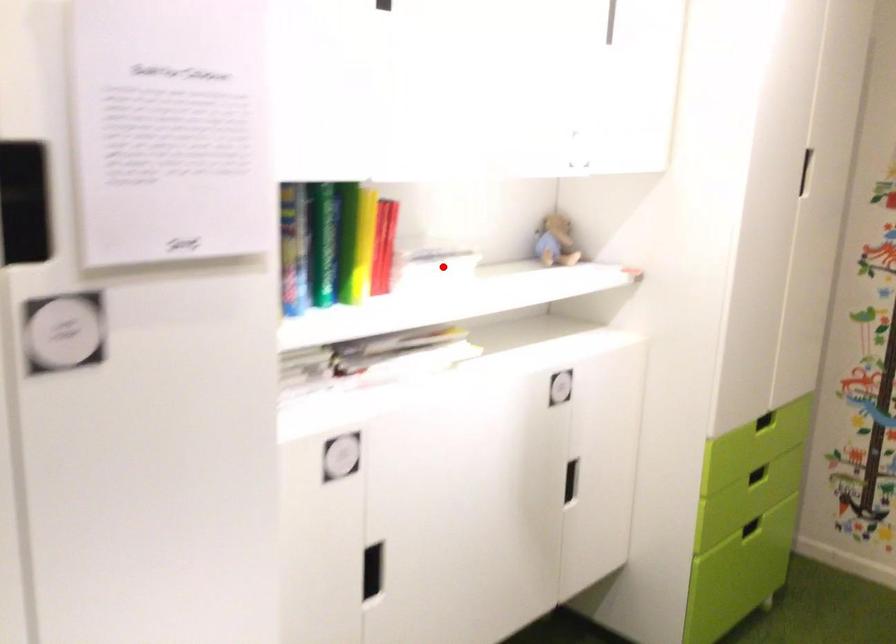
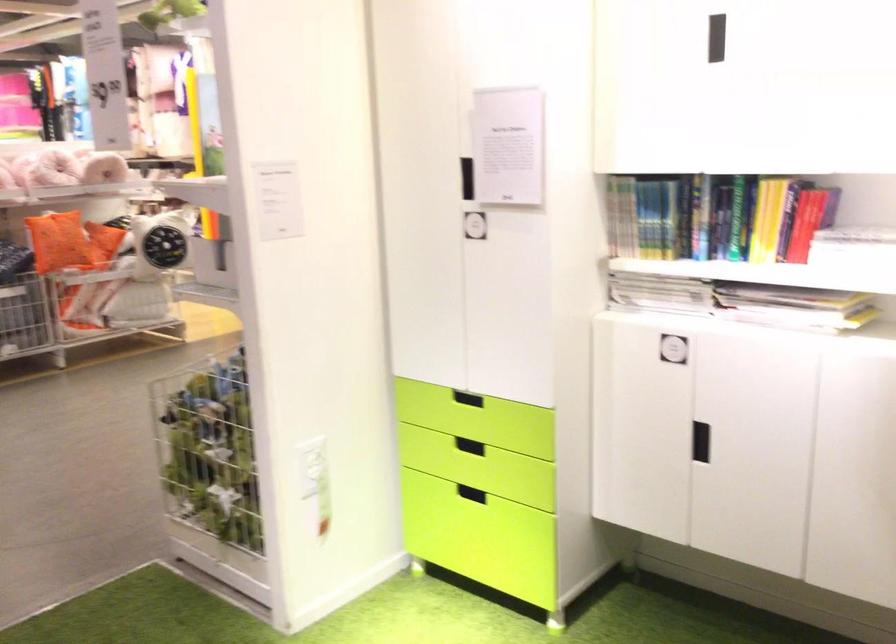
Question: I am providing you with two images of the same scene from different viewpoints. In image1, a red point is highlighted. Considering the same 3D point in image2, which of the following is correct?

Choices:
 (A) It is closer
 (B) It is farther

Answer: (B)